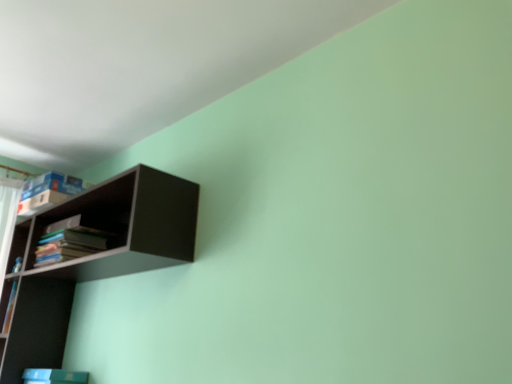
Question: From a real-world perspective, is matte black shelf at upper left above or below hardcover books at left?

Choices:
 (A) below
 (B) above

Answer: (A)

Question: Is point (187, 198) closer or farther from the camera than point (62, 258)?

Choices:
 (A) closer
 (B) farther

Answer: (A)

Question: Is matte black shelf at upper left in front of or behind hardcover books at left in the image?

Choices:
 (A) front
 (B) behind

Answer: (A)

Question: Considering the relative positions of hardcover books at left and matte black shelf at upper left in the image provided, is hardcover books at left to the left or to the right of matte black shelf at upper left?

Choices:
 (A) right
 (B) left

Answer: (B)

Question: In terms of width, does hardcover books at left look wider or thinner when compared to matte black shelf at upper left?

Choices:
 (A) wide
 (B) thin

Answer: (B)

Question: From a real-world perspective, is hardcover books at left above or below matte black shelf at upper left?

Choices:
 (A) above
 (B) below

Answer: (A)

Question: Is point (105, 241) positioned closer to the camera than point (108, 211)?

Choices:
 (A) closer
 (B) farther

Answer: (A)